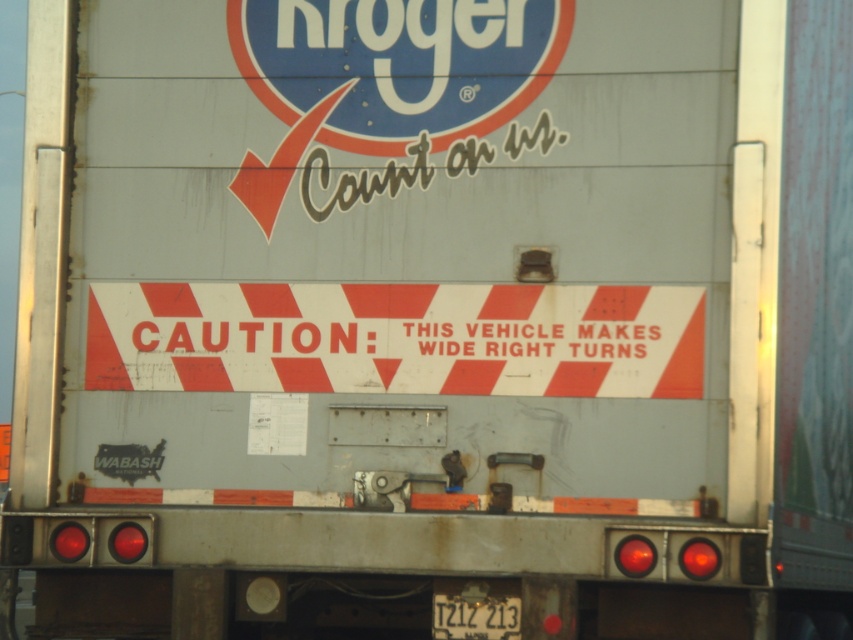
Question: Is white/red striped sign at center below black plastic license plate at bottom center?

Choices:
 (A) yes
 (B) no

Answer: (B)

Question: Does white/red striped sign at center have a larger size compared to black plastic license plate at bottom center?

Choices:
 (A) yes
 (B) no

Answer: (A)

Question: Which of the following is the farthest from the observer?

Choices:
 (A) (438, 630)
 (B) (282, 291)

Answer: (B)

Question: Can you confirm if white/red striped sign at center is bigger than black plastic license plate at bottom center?

Choices:
 (A) no
 (B) yes

Answer: (B)